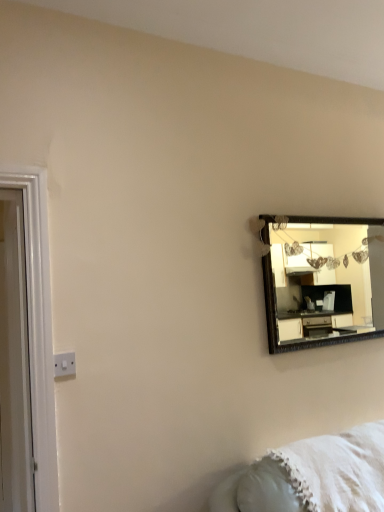
Question: Is wooden-framed mirror at upper right taller or shorter than white fluffy blanket at lower right?

Choices:
 (A) short
 (B) tall

Answer: (B)

Question: From a real-world perspective, is wooden-framed mirror at upper right physically located above or below white fluffy blanket at lower right?

Choices:
 (A) above
 (B) below

Answer: (A)

Question: Which of these objects is positioned farthest from the white fluffy blanket at lower right?

Choices:
 (A) white plastic switch at lower left
 (B) white glossy door at left
 (C) wooden-framed mirror at upper right

Answer: (B)

Question: Which of these objects is positioned farthest from the white fluffy blanket at lower right?

Choices:
 (A) wooden-framed mirror at upper right
 (B) white glossy door at left
 (C) white plastic switch at lower left

Answer: (B)